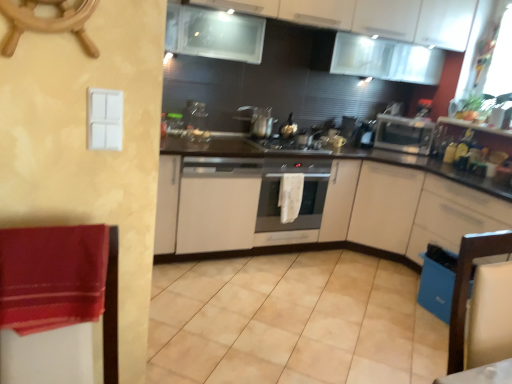
Image resolution: width=512 pixels, height=384 pixels. What do you see at coordinates (292, 322) in the screenshot? I see `beige tile at center` at bounding box center [292, 322].

Locate an element on the screen. The height and width of the screenshot is (384, 512). wooden chair at lower right is located at coordinates (467, 286).

The image size is (512, 384). What do you see at coordinates (52, 276) in the screenshot?
I see `velvet red blanket at left` at bounding box center [52, 276].

The height and width of the screenshot is (384, 512). Describe the element at coordinates (302, 195) in the screenshot. I see `satin silver oven at center` at that location.

The image size is (512, 384). What are the coordinates of `beige tile at center` in the screenshot? It's located at (292, 322).

How many degrees apart are the facing directions of white plastic light switch at upper left and white matte cabinet at center, positioned as the first cabinetry in bottom-to-top order?

The angle between the facing direction of white plastic light switch at upper left and the facing direction of white matte cabinet at center, positioned as the first cabinetry in bottom-to-top order, is 0.0589 degrees.

From a real-world perspective, is white plastic light switch at upper left positioned above or below white matte cabinet at center, positioned as the first cabinetry in bottom-to-top order?

white plastic light switch at upper left is above white matte cabinet at center, positioned as the first cabinetry in bottom-to-top order.

Considering the sizes of objects white plastic light switch at upper left and white matte cabinet at center, positioned as the first cabinetry in bottom-to-top order, in the image provided, who is thinner, white plastic light switch at upper left or white matte cabinet at center, positioned as the first cabinetry in bottom-to-top order,?

Thinner between the two is white plastic light switch at upper left.

From a real-world perspective, is white plastic light switch at upper left beneath beige tile at center?

Actually, white plastic light switch at upper left is physically above beige tile at center in the real world.

Consider the image. From the image's perspective, is white plastic light switch at upper left located beneath beige tile at center?

Incorrect, from the image's perspective, white plastic light switch at upper left is higher than beige tile at center.

Is white plastic light switch at upper left positioned beyond the bounds of beige tile at center?

Absolutely, white plastic light switch at upper left is external to beige tile at center.

Is point (93, 133) closer to viewer compared to point (224, 292)?

That is True.

Is beige tile at center not within satin silver toaster at right?

Yes, beige tile at center is outside of satin silver toaster at right.

In the scene shown: From a real-world perspective, is beige tile at center positioned over satin silver toaster at right based on gravity?

No.

How far apart are beige tile at center and satin silver toaster at right?

1.82 meters.

From the image's perspective, would you say beige tile at center is shown under satin silver toaster at right?

Yes, from the image's perspective, beige tile at center is beneath satin silver toaster at right.

Is the depth of wooden ship's wheel at upper left greater than that of white glossy cabinets at upper center, which is the first cabinetry from top to bottom?

No, wooden ship's wheel at upper left is closer to the viewer.

Which of these two, wooden ship's wheel at upper left or white glossy cabinets at upper center, which is counted as the 4th cabinetry, starting from the bottom, is thinner?

Thinner between the two is wooden ship's wheel at upper left.

Is wooden ship's wheel at upper left positioned beyond the bounds of white glossy cabinets at upper center, which is counted as the 4th cabinetry, starting from the bottom?

That's correct, wooden ship's wheel at upper left is outside of white glossy cabinets at upper center, which is counted as the 4th cabinetry, starting from the bottom.

In the image, is wooden ship's wheel at upper left on the left side or the right side of white glossy cabinets at upper center, which is counted as the 4th cabinetry, starting from the bottom?

wooden ship's wheel at upper left is to the left of white glossy cabinets at upper center, which is counted as the 4th cabinetry, starting from the bottom.

Considering the relative sizes of white matte cabinet at center, the second cabinetry positioned from the top, and black matte gas stove at center in the image provided, is white matte cabinet at center, the second cabinetry positioned from the top, wider than black matte gas stove at center?

Yes.

Is white matte cabinet at center, the second cabinetry positioned from the top, looking in the opposite direction of black matte gas stove at center?

No, white matte cabinet at center, the second cabinetry positioned from the top, is not facing the opposite direction of black matte gas stove at center.

Considering the relative positions of white matte cabinet at center, the second cabinetry positioned from the top, and black matte gas stove at center in the image provided, is white matte cabinet at center, the second cabinetry positioned from the top, to the left or to the right of black matte gas stove at center?

Based on their positions, white matte cabinet at center, the second cabinetry positioned from the top, is located to the left of black matte gas stove at center.

In terms of size, does white matte cabinet at center, the second cabinetry positioned from the top, appear bigger or smaller than black matte gas stove at center?

In the image, white matte cabinet at center, the second cabinetry positioned from the top, appears to be larger than black matte gas stove at center.

Does black matte gas stove at center have a greater height compared to wooden ship's wheel at upper left?

In fact, black matte gas stove at center may be shorter than wooden ship's wheel at upper left.

Based on the photo, is wooden ship's wheel at upper left at the back of black matte gas stove at center?

No.

Do you think black matte gas stove at center is within wooden ship's wheel at upper left, or outside of it?

black matte gas stove at center exists outside the volume of wooden ship's wheel at upper left.

From the image's perspective, which object appears higher, blue plastic dishwasher at lower right or wooden chair at lower right?

wooden chair at lower right is shown above in the image.

In the scene shown: Are blue plastic dishwasher at lower right and wooden chair at lower right beside each other?

They are not placed beside each other.

From a real-world perspective, is blue plastic dishwasher at lower right under wooden chair at lower right?

Yes, from a real-world perspective, blue plastic dishwasher at lower right is under wooden chair at lower right.

The image size is (512, 384). Find the location of `light switch on the left of white matte cabinet at center, positioned as the first cabinetry in bottom-to-top order`. light switch on the left of white matte cabinet at center, positioned as the first cabinetry in bottom-to-top order is located at coordinates (105, 119).

The width and height of the screenshot is (512, 384). What are the coordinates of `light switch above the beige tile at center (from the image's perspective)` in the screenshot? It's located at (x=105, y=119).

Considering their positions, is wooden ship's wheel at upper left positioned further to white matte cabinet at center, marked as the 2th cabinetry in a bottom-to-top arrangement, than wooden chair at lower right?

wooden ship's wheel at upper left is positioned further to the anchor white matte cabinet at center, marked as the 2th cabinetry in a bottom-to-top arrangement.

When comparing their distances from white matte cabinet at center, the second cabinetry positioned from the top, does white glossy cabinets at upper center, which is counted as the 4th cabinetry, starting from the bottom, or white plastic light switch at upper left seem closer?

white glossy cabinets at upper center, which is counted as the 4th cabinetry, starting from the bottom.

Estimate the real-world distances between objects in this image. Which object is further from white matte cabinet at center, positioned as the first cabinetry in bottom-to-top order, velvet red blanket at left or white glossy cabinets at upper center, which is the first cabinetry from top to bottom?

velvet red blanket at left is positioned further to the anchor white matte cabinet at center, positioned as the first cabinetry in bottom-to-top order.

When comparing their distances from velvet red blanket at left, does black matte gas stove at center or white matte cabinet at center, acting as the fourth cabinetry starting from the top, seem closer?

black matte gas stove at center lies closer to velvet red blanket at left than the other object.

When comparing their distances from wooden chair at lower right, does white textured hand towel at center or satin silver pot at center seem further?

satin silver pot at center is positioned further to the anchor wooden chair at lower right.

From the image, which object appears to be farther from beige tile at center, white textured hand towel at center or white matte cabinet at center, the second cabinetry positioned from the top?

white textured hand towel at center lies further to beige tile at center than the other object.

Estimate the real-world distances between objects in this image. Which object is further from satin silver pot at center, white glossy cabinets at upper center, which is the first cabinetry from top to bottom, or white matte cabinet at center, acting as the fourth cabinetry starting from the top?

Based on the image, white matte cabinet at center, acting as the fourth cabinetry starting from the top, appears to be further to satin silver pot at center.

From the image, which object appears to be farther from white glossy cabinets at upper center, which is the first cabinetry from top to bottom, wooden ship's wheel at upper left or satin silver oven at center?

The object further to white glossy cabinets at upper center, which is the first cabinetry from top to bottom, is wooden ship's wheel at upper left.

Find the location of a particular element. The height and width of the screenshot is (384, 512). gas stove situated between white matte cabinet at center, the second cabinetry positioned from the top, and satin silver oven at center from left to right is located at coordinates (287, 145).

You are a GUI agent. You are given a task and a screenshot of the screen. Output one action in this format:
    pyautogui.click(x=<x>, y=<y>)
    Task: Click on the oven between white plastic light switch at upper left and satin silver toaster at right in the front-back direction
    This screenshot has width=512, height=384.
    Given the screenshot: What is the action you would take?
    pyautogui.click(x=302, y=195)

Locate an element on the screen. This screenshot has width=512, height=384. hand towel between satin silver pot at center and white matte cabinet at center, positioned as the first cabinetry in bottom-to-top order, in the horizontal direction is located at coordinates (290, 196).

This screenshot has height=384, width=512. In order to click on gas stove positioned between wooden chair at lower right and white matte cabinet at center, acting as the fourth cabinetry starting from the top, from near to far in this screenshot , I will do `click(287, 145)`.